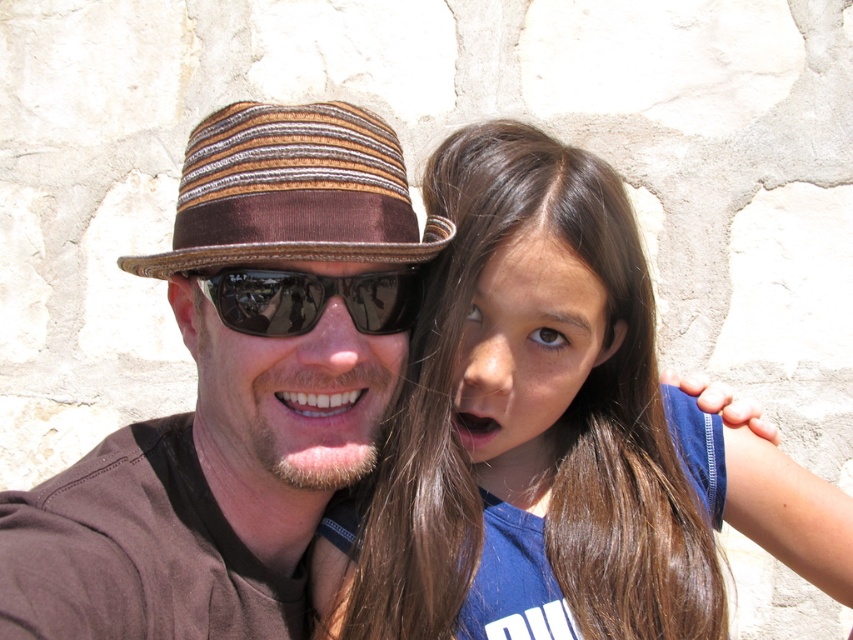
Does point (467, 515) come behind point (312, 115)?

Yes, point (467, 515) is farther from viewer.

Can you confirm if brown hair at center is positioned to the right of brown striped fabric fedora at upper center?

Indeed, brown hair at center is positioned on the right side of brown striped fabric fedora at upper center.

I want to click on brown hair at center, so click(554, 435).

The height and width of the screenshot is (640, 853). I want to click on brown hair at center, so click(554, 435).

Based on the photo, can you confirm if brown corduroy hat at center is positioned above black reflective sunglasses at center?

Incorrect, brown corduroy hat at center is not positioned above black reflective sunglasses at center.

Is point (294, 531) less distant than point (265, 314)?

No, (294, 531) is behind (265, 314).

Is point (404, 342) positioned before point (419, 291)?

Yes, point (404, 342) is in front of point (419, 291).

Identify the location of brown corduroy hat at center. The width and height of the screenshot is (853, 640). (236, 390).

Is brown hair at center taller than black reflective sunglasses at center?

Yes, brown hair at center is taller than black reflective sunglasses at center.

How much distance is there between brown hair at center and black reflective sunglasses at center?

brown hair at center and black reflective sunglasses at center are 11.44 inches apart from each other.

The width and height of the screenshot is (853, 640). Describe the element at coordinates (554, 435) in the screenshot. I see `brown hair at center` at that location.

Locate an element on the screen. The image size is (853, 640). brown hair at center is located at coordinates (554, 435).